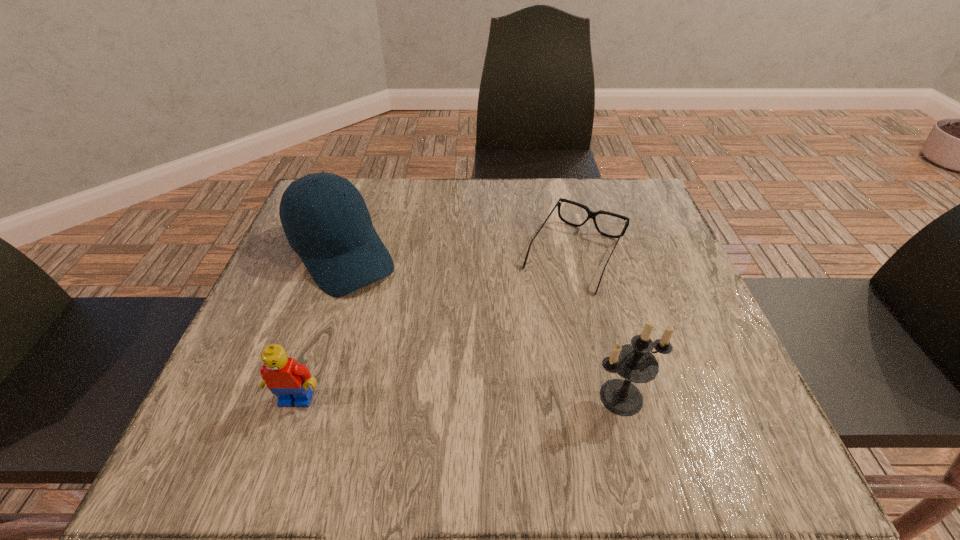
You are a GUI agent. You are given a task and a screenshot of the screen. Output one action in this format:
    pyautogui.click(x=<x>, y=<y>)
    Task: Click on the vacant spot on the desktop that is between the second shortest object and the candle holder and is positioned with the lenses facing outward on the spectacles
    The width and height of the screenshot is (960, 540).
    Given the screenshot: What is the action you would take?
    pyautogui.click(x=489, y=398)

Image resolution: width=960 pixels, height=540 pixels. I want to click on vacant space on the desktop that is between the Lego and the candle holder and is positioned on the front-facing side of the baseball cap, so click(453, 398).